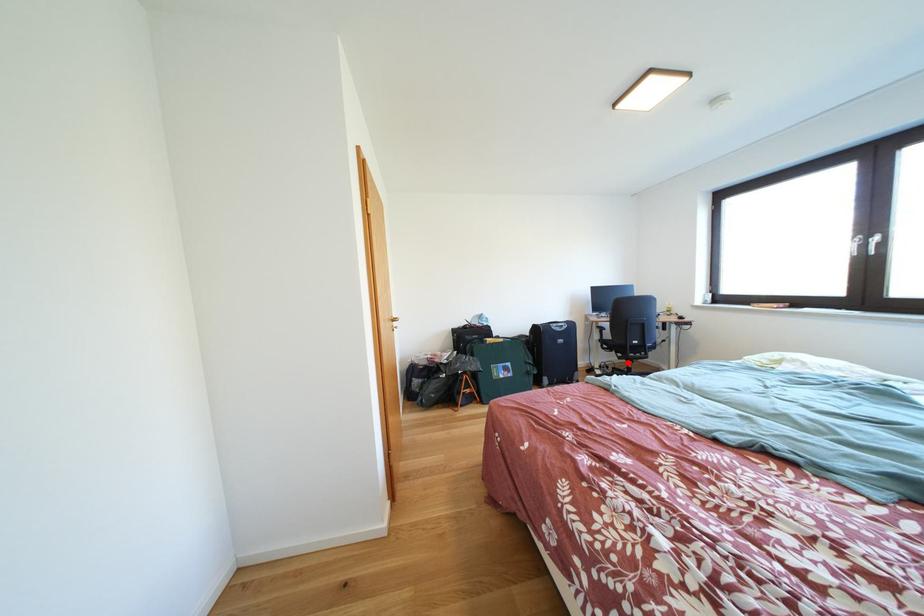
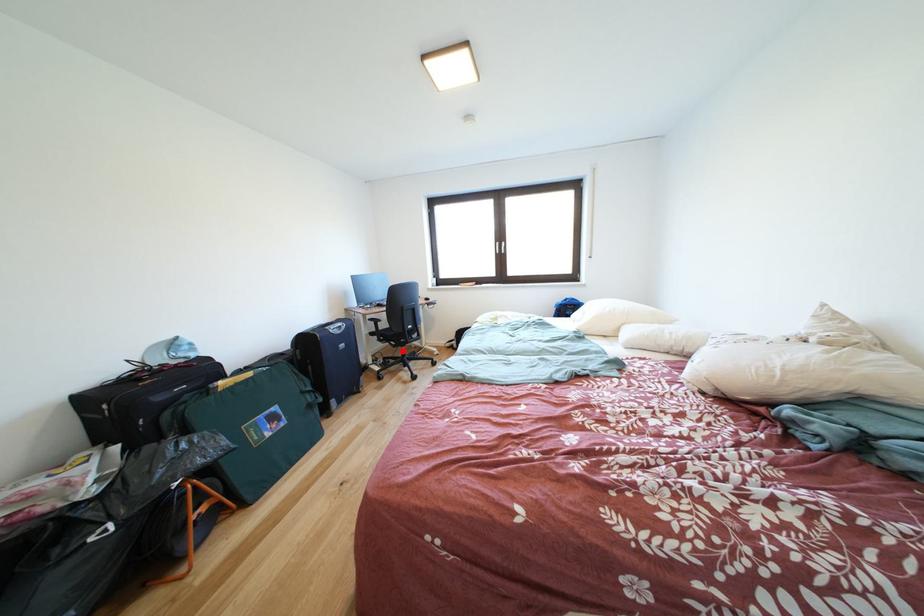
I am providing you with two images of the same scene from different viewpoints. A red point is marked on the first image and another point is marked on the second image. Is the marked point in image1 the same physical position as the marked point in image2?

Yes